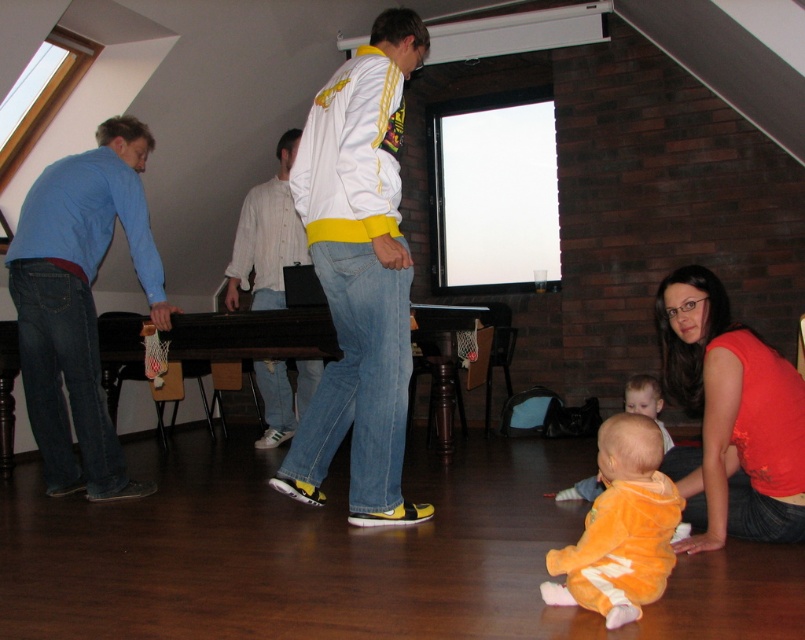
You are standing in the room and want to locate the white cotton shirt at center. Which direction should you look to find it?

The white cotton shirt at center is located at the coordinates point [267,236], so you should look towards the center of the room to find it.

You are a delivery person who just arrived at the loft to deliver a package. You see an orange plush onesie at lower center and an orange plush baby at lower center. The package is meant for the person closest to the door. Which item should you deliver the package to?

The orange plush onesie at lower center and orange plush baby at lower center are 89.55 centimeters apart, but the description does not specify which is closer to the door. Therefore, it is unclear which item is closer, so you cannot determine the correct recipient based on the provided information.